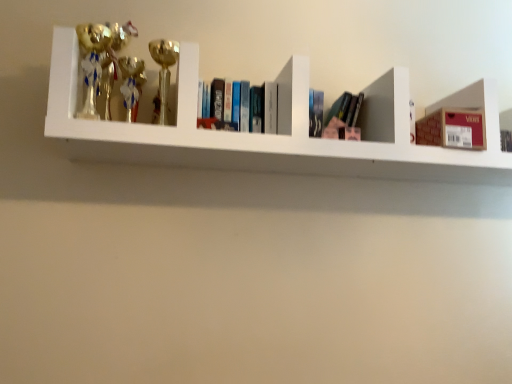
What do you see at coordinates (94, 63) in the screenshot?
I see `gold shiny trophy at left, which ranks as the 2th toy in right-to-left order` at bounding box center [94, 63].

What is the approximate height of gold shiny trophy at upper left, which is the first toy from right to left?

gold shiny trophy at upper left, which is the first toy from right to left, is 11.64 inches in height.

You are a GUI agent. You are given a task and a screenshot of the screen. Output one action in this format:
    pyautogui.click(x=<x>, y=<y>)
    Task: Click on the gold shiny trophy at upper left, the second toy viewed from the left
    The height and width of the screenshot is (384, 512).
    Given the screenshot: What is the action you would take?
    pyautogui.click(x=163, y=76)

Describe the element at coordinates (249, 110) in the screenshot. I see `hardcover books at center` at that location.

You are a GUI agent. You are given a task and a screenshot of the screen. Output one action in this format:
    pyautogui.click(x=<x>, y=<y>)
    Task: Click on the gold shiny trophy at left, which ranks as the 2th toy in right-to-left order
    The width and height of the screenshot is (512, 384).
    Given the screenshot: What is the action you would take?
    pyautogui.click(x=94, y=63)

From the picture: Does metallic trophies at left have a lesser height compared to gold shiny trophy at left, which ranks as the 2th toy in right-to-left order?

In fact, metallic trophies at left may be taller than gold shiny trophy at left, which ranks as the 2th toy in right-to-left order.

Would you say metallic trophies at left is outside gold shiny trophy at left, which ranks as the 2th toy in right-to-left order?

Yes, metallic trophies at left is not within gold shiny trophy at left, which ranks as the 2th toy in right-to-left order.

From a real-world perspective, between metallic trophies at left and gold shiny trophy at left, which is the 1th toy in left-to-right order, who is vertically higher?

In real-world perspective, gold shiny trophy at left, which is the 1th toy in left-to-right order, is above.

Is metallic trophies at left with gold shiny trophy at left, which is the 1th toy in left-to-right order?

metallic trophies at left is not next to gold shiny trophy at left, which is the 1th toy in left-to-right order, and they're not touching.

Looking at the image, does gold shiny trophy at left, which ranks as the 2th toy in right-to-left order, seem bigger or smaller compared to hardcover books at center?

Considering their sizes, gold shiny trophy at left, which ranks as the 2th toy in right-to-left order, takes up less space than hardcover books at center.

Which object is positioned more to the right, gold shiny trophy at left, which ranks as the 2th toy in right-to-left order, or hardcover books at center?

From the viewer's perspective, hardcover books at center appears more on the right side.

Is gold shiny trophy at left, which ranks as the 2th toy in right-to-left order, turned away from hardcover books at center?

No, gold shiny trophy at left, which ranks as the 2th toy in right-to-left order, is not facing away from hardcover books at center.

Which of these two, gold shiny trophy at left, which is the 1th toy in left-to-right order, or hardcover books at center, is wider?

hardcover books at center.

Considering the positions of objects gold shiny trophy at upper left, the second toy viewed from the left, and hardcover books at center in the image provided, who is more to the left, gold shiny trophy at upper left, the second toy viewed from the left, or hardcover books at center?

gold shiny trophy at upper left, the second toy viewed from the left.

Find the location of a particular element. This screenshot has height=384, width=512. book located below the gold shiny trophy at upper left, which is the first toy from right to left (from the image's perspective) is located at coordinates (249, 110).

How different are the orientations of gold shiny trophy at upper left, which is the first toy from right to left, and hardcover books at center in degrees?

The angle between the facing direction of gold shiny trophy at upper left, which is the first toy from right to left, and the facing direction of hardcover books at center is 0.919 degrees.

Which of these two, metallic trophies at left or hardcover books at center, stands taller?

With more height is metallic trophies at left.

Choose the correct answer: Is metallic trophies at left inside hardcover books at center or outside it?

metallic trophies at left is not enclosed by hardcover books at center.

Is metallic trophies at left oriented towards hardcover books at center?

Yes.

Is metallic trophies at left far away from hardcover books at center?

That's not correct — metallic trophies at left is a little close to hardcover books at center.

From a real-world perspective, between hardcover books at center and metallic trophies at left, who is vertically higher?

hardcover books at center.

Which object is closer to the camera, hardcover books at center or metallic trophies at left?

metallic trophies at left.

At what (x,y) coordinates should I click in order to perform the action: click on shelf below the hardcover books at center (from a real-world perspective). Please return your answer as a coordinate pair (x, y). This screenshot has width=512, height=384. Looking at the image, I should click on (261, 134).

How different are the orientations of hardcover books at center and metallic trophies at left in degrees?

They differ by 0.907 degrees in their facing directions.

Which is more to the left, metallic trophies at left or gold shiny trophy at upper left, which is the first toy from right to left?

Positioned to the left is gold shiny trophy at upper left, which is the first toy from right to left.

This screenshot has height=384, width=512. I want to click on shelf beneath the gold shiny trophy at upper left, the second toy viewed from the left (from a real-world perspective), so pyautogui.click(x=261, y=134).

From the image's perspective, is metallic trophies at left above or below gold shiny trophy at upper left, the second toy viewed from the left?

From the image's perspective, metallic trophies at left appears below gold shiny trophy at upper left, the second toy viewed from the left.

From the image's perspective, between gold shiny trophy at upper left, the second toy viewed from the left, and gold shiny trophy at left, which ranks as the 2th toy in right-to-left order, who is located below?

From the image's view, gold shiny trophy at upper left, the second toy viewed from the left, is below.

I want to click on toy below the gold shiny trophy at left, which is the 1th toy in left-to-right order (from the image's perspective), so click(x=163, y=76).

Is gold shiny trophy at upper left, which is the first toy from right to left, not close to gold shiny trophy at left, which is the 1th toy in left-to-right order?

No, gold shiny trophy at upper left, which is the first toy from right to left, is not far away from gold shiny trophy at left, which is the 1th toy in left-to-right order.

Which object is thinner, gold shiny trophy at upper left, which is the first toy from right to left, or gold shiny trophy at left, which ranks as the 2th toy in right-to-left order?

Thinner between the two is gold shiny trophy at left, which ranks as the 2th toy in right-to-left order.

I want to click on the 2nd toy above the metallic trophies at left (from a real-world perspective), so click(94, 63).

Find the location of `toy that is the 2nd one when counting leftward from the hardcover books at center`. toy that is the 2nd one when counting leftward from the hardcover books at center is located at coordinates (94, 63).

Which object lies further to the anchor point gold shiny trophy at upper left, the second toy viewed from the left, hardcover books at center or gold shiny trophy at left, which is the 1th toy in left-to-right order?

hardcover books at center lies further to gold shiny trophy at upper left, the second toy viewed from the left, than the other object.

From the image, which object appears to be nearer to gold shiny trophy at left, which ranks as the 2th toy in right-to-left order, metallic trophies at left or hardcover books at center?

hardcover books at center lies closer to gold shiny trophy at left, which ranks as the 2th toy in right-to-left order, than the other object.

Looking at the image, which one is located further to metallic trophies at left, gold shiny trophy at upper left, which is the first toy from right to left, or gold shiny trophy at left, which is the 1th toy in left-to-right order?

The object further to metallic trophies at left is gold shiny trophy at left, which is the 1th toy in left-to-right order.

Looking at the image, which one is located closer to hardcover books at center, metallic trophies at left or gold shiny trophy at left, which ranks as the 2th toy in right-to-left order?

Based on the image, metallic trophies at left appears to be nearer to hardcover books at center.

From the image, which object appears to be nearer to gold shiny trophy at left, which ranks as the 2th toy in right-to-left order, hardcover books at center or metallic trophies at left?

Based on the image, hardcover books at center appears to be nearer to gold shiny trophy at left, which ranks as the 2th toy in right-to-left order.

From the image, which object appears to be nearer to gold shiny trophy at left, which ranks as the 2th toy in right-to-left order, metallic trophies at left or gold shiny trophy at upper left, which is the first toy from right to left?

The object closer to gold shiny trophy at left, which ranks as the 2th toy in right-to-left order, is gold shiny trophy at upper left, which is the first toy from right to left.

Which object lies nearer to the anchor point metallic trophies at left, hardcover books at center or gold shiny trophy at left, which ranks as the 2th toy in right-to-left order?

hardcover books at center is closer to metallic trophies at left.

Which object lies nearer to the anchor point hardcover books at center, gold shiny trophy at upper left, which is the first toy from right to left, or metallic trophies at left?

Among the two, gold shiny trophy at upper left, which is the first toy from right to left, is located nearer to hardcover books at center.

This screenshot has height=384, width=512. What are the coordinates of `book located between gold shiny trophy at left, which is the 1th toy in left-to-right order, and metallic trophies at left in the left-right direction` in the screenshot? It's located at (249, 110).

Locate an element on the screen. The width and height of the screenshot is (512, 384). toy situated between gold shiny trophy at left, which is the 1th toy in left-to-right order, and metallic trophies at left from left to right is located at coordinates (163, 76).

Locate an element on the screen. toy located between gold shiny trophy at left, which ranks as the 2th toy in right-to-left order, and hardcover books at center in the left-right direction is located at coordinates (163, 76).

The width and height of the screenshot is (512, 384). Find the location of `book between gold shiny trophy at upper left, which is the first toy from right to left, and metallic trophies at left from left to right`. book between gold shiny trophy at upper left, which is the first toy from right to left, and metallic trophies at left from left to right is located at coordinates (249, 110).